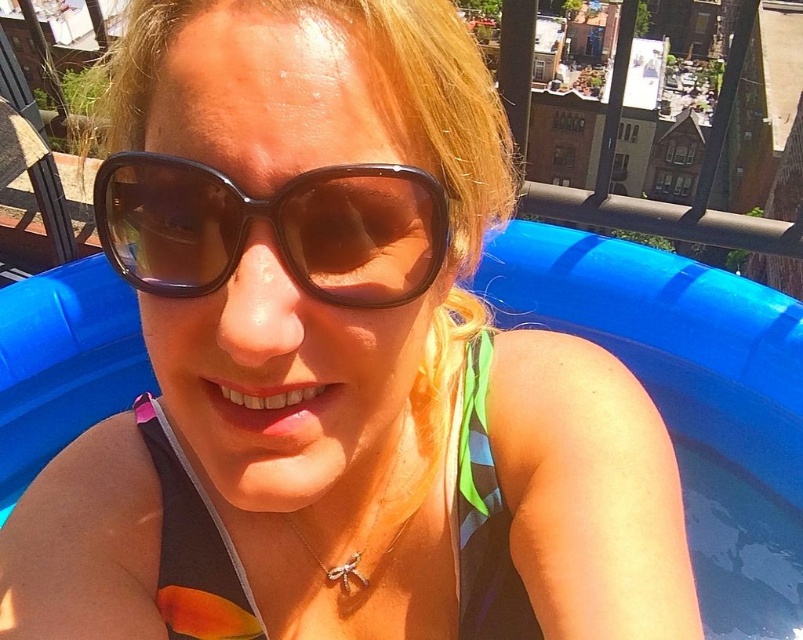
You are a photographer trying to capture the perfect shot of the brown shiny sunglasses at center. To ensure the sunglasses are in the frame, where should you position your camera relative to the person?

The brown shiny sunglasses at center are located at point coordinates of (272, 228), so you should position your camera directly facing the center of the person to capture the sunglasses in the frame.

You are a photographer trying to capture a clear shot of the black matte bikini top at center without any obstructions. Given that the brown shiny sunglasses at center are currently blocking the view, can you adjust your position to take the photo without moving the subject?

The brown shiny sunglasses at center is in front of the black matte bikini top at center, so you can move your camera position slightly to the side or angle it so that the sunglasses are no longer blocking the view of the black matte bikini top at center.